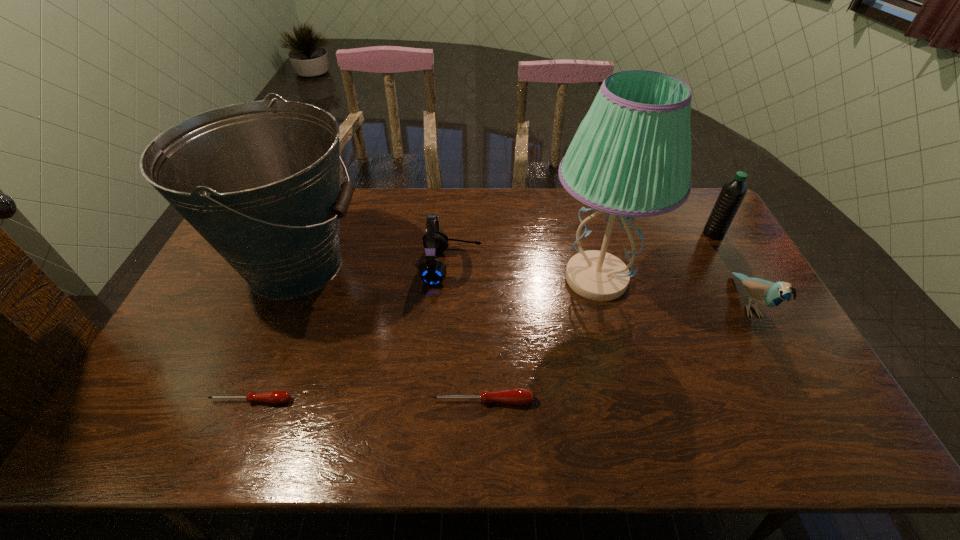
You are a GUI agent. You are given a task and a screenshot of the screen. Output one action in this format:
    pyautogui.click(x=<x>, y=<y>)
    Task: Click on the left screwdriver
    The height and width of the screenshot is (540, 960).
    Given the screenshot: What is the action you would take?
    pyautogui.click(x=274, y=397)

Find the location of a particular element. This screenshot has height=540, width=960. the shorter screwdriver is located at coordinates click(x=274, y=397).

Locate an element on the screen. The image size is (960, 540). the second shortest object is located at coordinates (511, 396).

The width and height of the screenshot is (960, 540). In order to click on the right screwdriver in this screenshot , I will do `click(511, 396)`.

I want to click on water bottle, so click(x=733, y=192).

Identify the location of headset. Image resolution: width=960 pixels, height=540 pixels. (432, 271).

Where is `the second tallest object`? the second tallest object is located at coordinates (260, 181).

Find the location of a particular element. bird is located at coordinates (766, 293).

Locate an element on the screen. This screenshot has width=960, height=540. the tallest object is located at coordinates (631, 156).

At what (x,y) coordinates should I click in order to perform the action: click on the third object from right to left. Please return your answer as a coordinate pair (x, y). The width and height of the screenshot is (960, 540). Looking at the image, I should click on (631, 156).